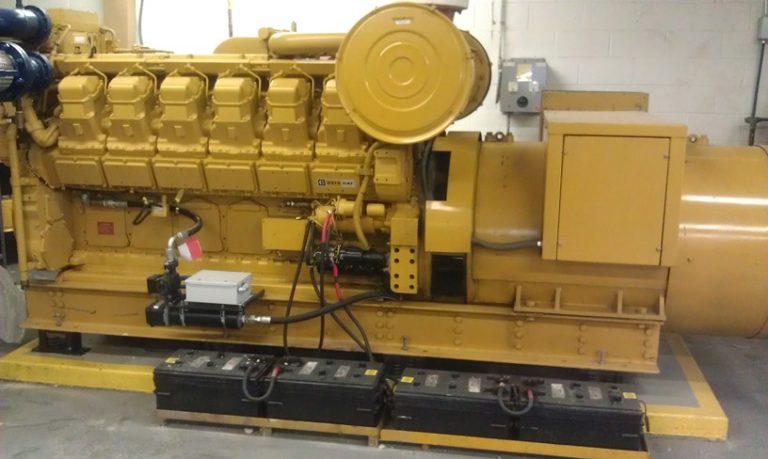
I want to click on white wall, so click(x=629, y=61).